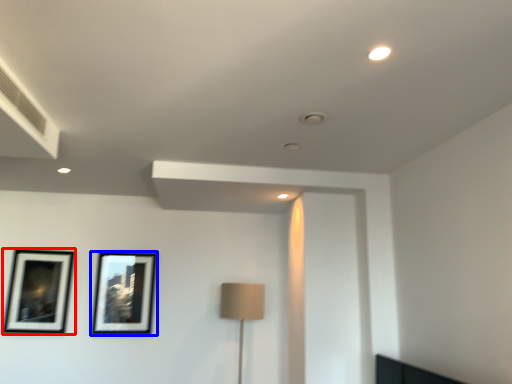
Question: Among these objects, which one is farthest to the camera, picture frame (highlighted by a red box) or picture frame (highlighted by a blue box)?

Choices:
 (A) picture frame
 (B) picture frame

Answer: (B)